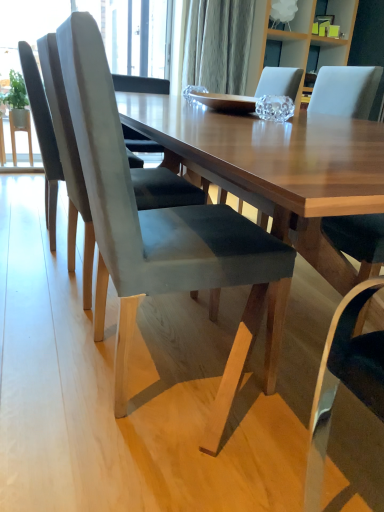
You are a GUI agent. You are given a task and a screenshot of the screen. Output one action in this format:
    pyautogui.click(x=<x>, y=<y>)
    Task: Click on the free point to the left of suede gray chair at left, arranged as the 2th chair when viewed from the front
    
    Given the screenshot: What is the action you would take?
    pyautogui.click(x=28, y=276)